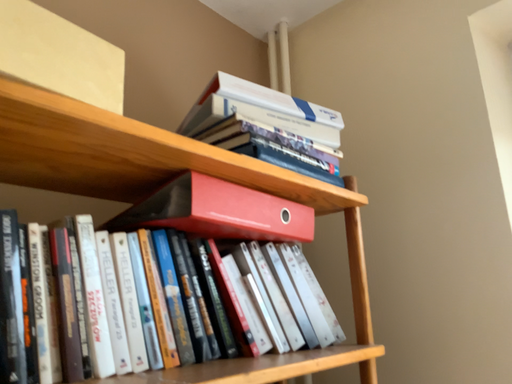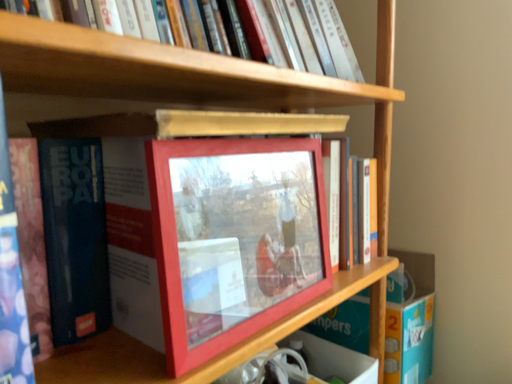
Question: How did the camera likely rotate when shooting the video?

Choices:
 (A) rotated downward
 (B) rotated upward

Answer: (A)